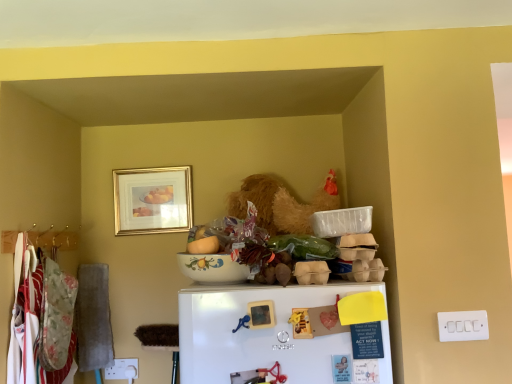
Question: Are porcelain floral bowl at center and gold/glass picture frame at upper center far apart?

Choices:
 (A) no
 (B) yes

Answer: (A)

Question: Is porcelain floral bowl at center taller than gold/glass picture frame at upper center?

Choices:
 (A) no
 (B) yes

Answer: (A)

Question: Is porcelain floral bowl at center smaller than gold/glass picture frame at upper center?

Choices:
 (A) no
 (B) yes

Answer: (A)

Question: Is porcelain floral bowl at center closer to camera compared to gold/glass picture frame at upper center?

Choices:
 (A) yes
 (B) no

Answer: (A)

Question: Can you confirm if porcelain floral bowl at center is positioned to the left of gold/glass picture frame at upper center?

Choices:
 (A) yes
 (B) no

Answer: (B)

Question: From the image's perspective, is porcelain floral bowl at center above gold/glass picture frame at upper center?

Choices:
 (A) yes
 (B) no

Answer: (B)

Question: Can you confirm if white matte refrigerator at lower center is bigger than matte ceramic bowl at center?

Choices:
 (A) yes
 (B) no

Answer: (A)

Question: Does white matte refrigerator at lower center come behind matte ceramic bowl at center?

Choices:
 (A) no
 (B) yes

Answer: (A)

Question: Can you confirm if white matte refrigerator at lower center is shorter than matte ceramic bowl at center?

Choices:
 (A) yes
 (B) no

Answer: (B)

Question: Is white matte refrigerator at lower center placed right next to matte ceramic bowl at center?

Choices:
 (A) yes
 (B) no

Answer: (B)

Question: Considering the relative sizes of white matte refrigerator at lower center and matte ceramic bowl at center in the image provided, is white matte refrigerator at lower center smaller than matte ceramic bowl at center?

Choices:
 (A) yes
 (B) no

Answer: (B)

Question: From the image's perspective, would you say white matte refrigerator at lower center is shown under matte ceramic bowl at center?

Choices:
 (A) yes
 (B) no

Answer: (A)

Question: From a real-world perspective, is porcelain floral bowl at center physically below white plastic switch at lower right?

Choices:
 (A) yes
 (B) no

Answer: (B)